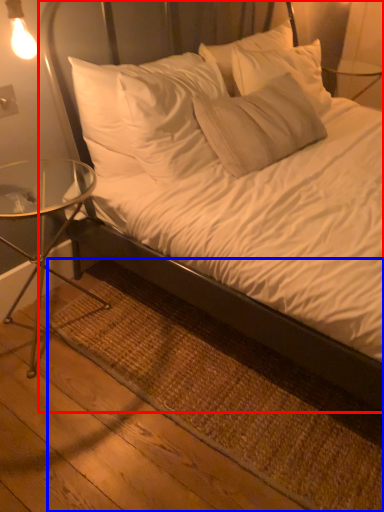
Question: Which of the following is the farthest to the observer, bed (highlighted by a red box) or mat (highlighted by a blue box)?

Choices:
 (A) bed
 (B) mat

Answer: (B)